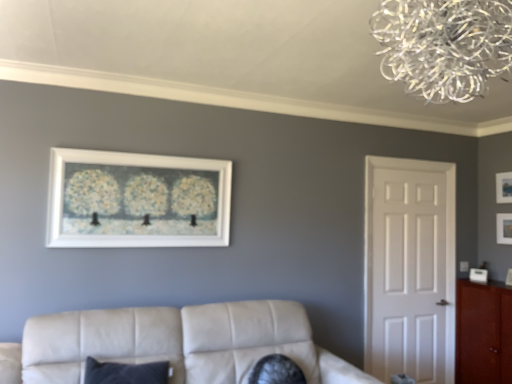
Question: From a real-world perspective, is matte black picture frame at upper right, the 1th picture frame viewed from the right, below white matte picture frame at upper center, which is counted as the 1th picture frame, starting from the front?

Choices:
 (A) yes
 (B) no

Answer: (B)

Question: Is the depth of matte black picture frame at upper right, which ranks as the third picture frame in left-to-right order, greater than that of white matte picture frame at upper center, which is counted as the 1th picture frame, starting from the front?

Choices:
 (A) yes
 (B) no

Answer: (A)

Question: Considering the relative sizes of matte black picture frame at upper right, the 1th picture frame viewed from the right, and white matte picture frame at upper center, arranged as the third picture frame when viewed from the right, in the image provided, is matte black picture frame at upper right, the 1th picture frame viewed from the right, wider than white matte picture frame at upper center, arranged as the third picture frame when viewed from the right,?

Choices:
 (A) no
 (B) yes

Answer: (A)

Question: From the image's perspective, is matte black picture frame at upper right, the 1th picture frame viewed from the right, below white matte picture frame at upper center, which is counted as the 1th picture frame, starting from the front?

Choices:
 (A) yes
 (B) no

Answer: (B)

Question: Are matte black picture frame at upper right, arranged as the first picture frame when viewed from the back, and white matte picture frame at upper center, which is counted as the 1th picture frame, starting from the front, making contact?

Choices:
 (A) yes
 (B) no

Answer: (B)

Question: Is matte black picture frame at upper right, arranged as the first picture frame when viewed from the back, oriented away from white matte picture frame at upper center, which is counted as the 1th picture frame, starting from the front?

Choices:
 (A) yes
 (B) no

Answer: (B)

Question: From a real-world perspective, is leather couch at lower center over white matte door at right?

Choices:
 (A) yes
 (B) no

Answer: (B)

Question: Does leather couch at lower center have a lesser width compared to white matte door at right?

Choices:
 (A) no
 (B) yes

Answer: (A)

Question: Is leather couch at lower center bigger than white matte door at right?

Choices:
 (A) yes
 (B) no

Answer: (A)

Question: Can you confirm if leather couch at lower center is smaller than white matte door at right?

Choices:
 (A) yes
 (B) no

Answer: (B)

Question: From the image's perspective, is leather couch at lower center on white matte door at right?

Choices:
 (A) yes
 (B) no

Answer: (B)

Question: Could you tell me if leather couch at lower center is turned towards white matte door at right?

Choices:
 (A) no
 (B) yes

Answer: (A)

Question: Is white matte door at right in contact with matte black picture frame at upper right, which ranks as the third picture frame in left-to-right order?

Choices:
 (A) yes
 (B) no

Answer: (B)